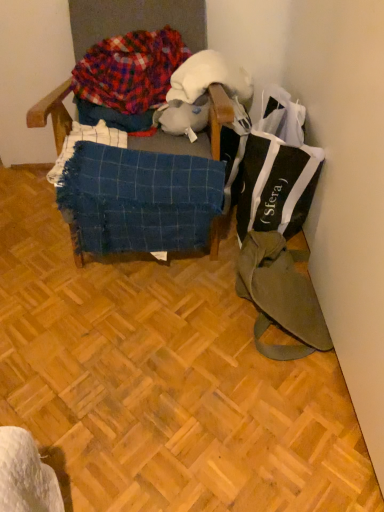
At what (x,y) coordinates should I click in order to perform the action: click on vacant space situated above wooden parquet floor at center (from a real-world perspective). Please return your answer as a coordinate pair (x, y). The image size is (384, 512). Looking at the image, I should click on (109, 324).